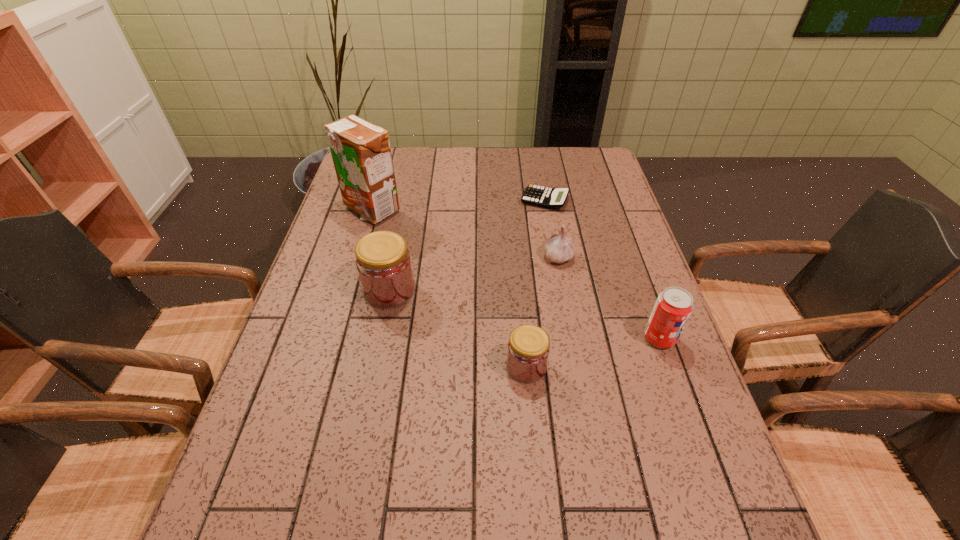
The jams are evenly distributed in the image. To maintain this, where would you place another jam on the right? Please point to a free space. Please provide its 2D coordinates. Your answer should be formatted as a tuple, i.e. [(x, y)], where the tuple contains the x and y coordinates of a point satisfying the conditions above.

[(719, 474)]